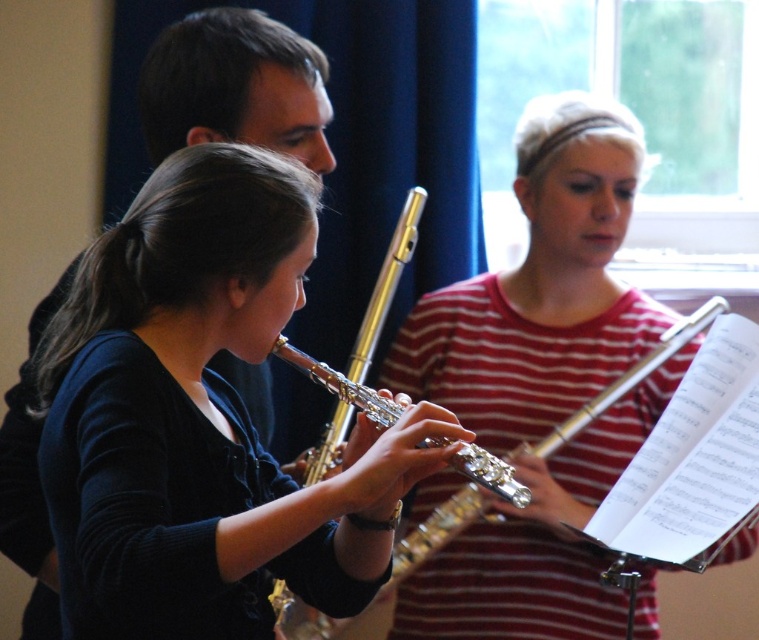
Question: Among these points, which one is nearest to the camera?

Choices:
 (A) 335,390
 (B) 597,445
 (C) 345,563

Answer: (C)

Question: Observing the image, what is the correct spatial positioning of matte gold flute at center in reference to silver metallic flute at center?

Choices:
 (A) above
 (B) below

Answer: (A)

Question: Which object is the farthest from the matte gold flute at center?

Choices:
 (A) silver metallic flute at center
 (B) metallic flute at center

Answer: (B)

Question: Is matte gold flute at center smaller than metallic flute at center?

Choices:
 (A) yes
 (B) no

Answer: (A)

Question: Which point is closer to the camera?

Choices:
 (A) matte gold flute at center
 (B) metallic flute at center
 (C) silver metallic flute at center

Answer: (A)

Question: Where is matte gold flute at center located in relation to silver metallic flute at center in the image?

Choices:
 (A) right
 (B) left

Answer: (B)